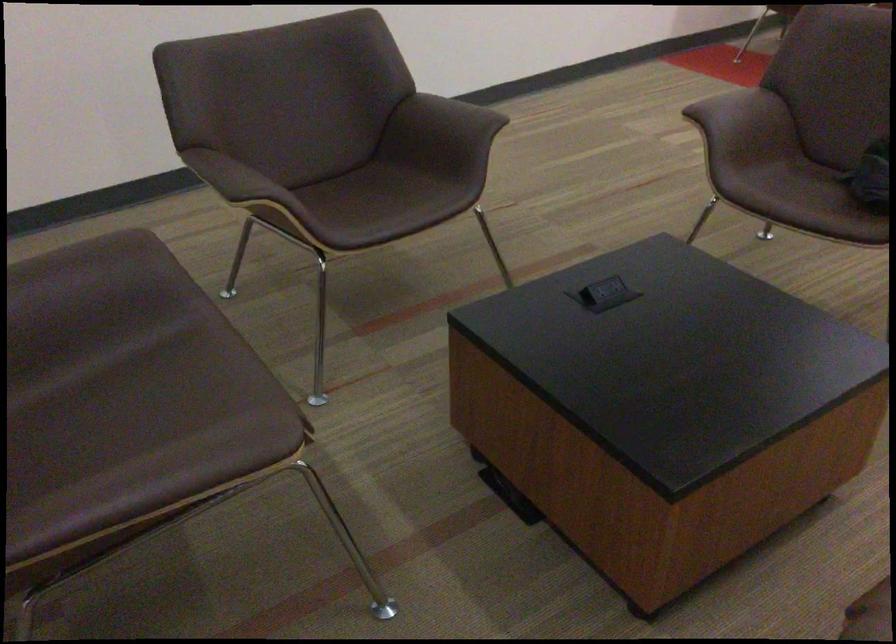
You are a GUI agent. You are given a task and a screenshot of the screen. Output one action in this format:
    pyautogui.click(x=<x>, y=<y>)
    Task: Click on the recessed power outlet
    
    Given the screenshot: What is the action you would take?
    pyautogui.click(x=609, y=292)